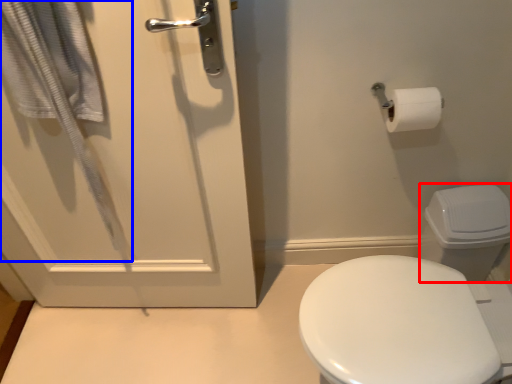
Question: Among these objects, which one is nearest to the camera, toilet bowl (highlighted by a red box) or bath towel (highlighted by a blue box)?

Choices:
 (A) toilet bowl
 (B) bath towel

Answer: (B)